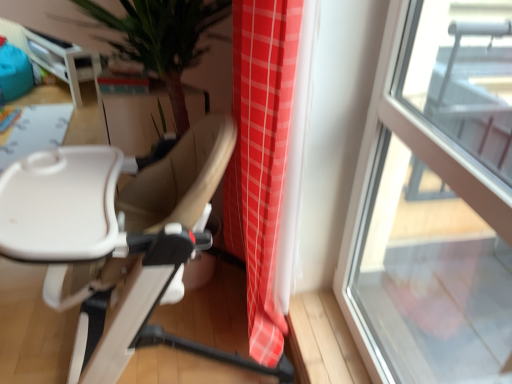
Question: Is beige leather chair at center taller or shorter than transparent glass window at right?

Choices:
 (A) tall
 (B) short

Answer: (B)

Question: Is beige leather chair at center to the left or to the right of transparent glass window at right in the image?

Choices:
 (A) right
 (B) left

Answer: (B)

Question: Which is nearer to the transparent glass window at right?

Choices:
 (A) beige leather chair at center
 (B) white glossy table at upper left

Answer: (A)

Question: Which of these objects is positioned farthest from the transparent glass window at right?

Choices:
 (A) white glossy table at upper left
 (B) beige leather chair at center

Answer: (A)